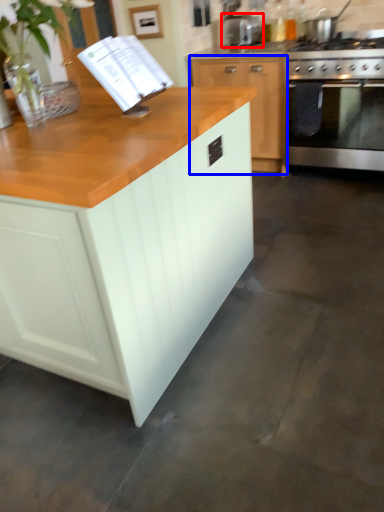
Question: Which object is further to the camera taking this photo, appliance (highlighted by a red box) or cabinetry (highlighted by a blue box)?

Choices:
 (A) appliance
 (B) cabinetry

Answer: (A)